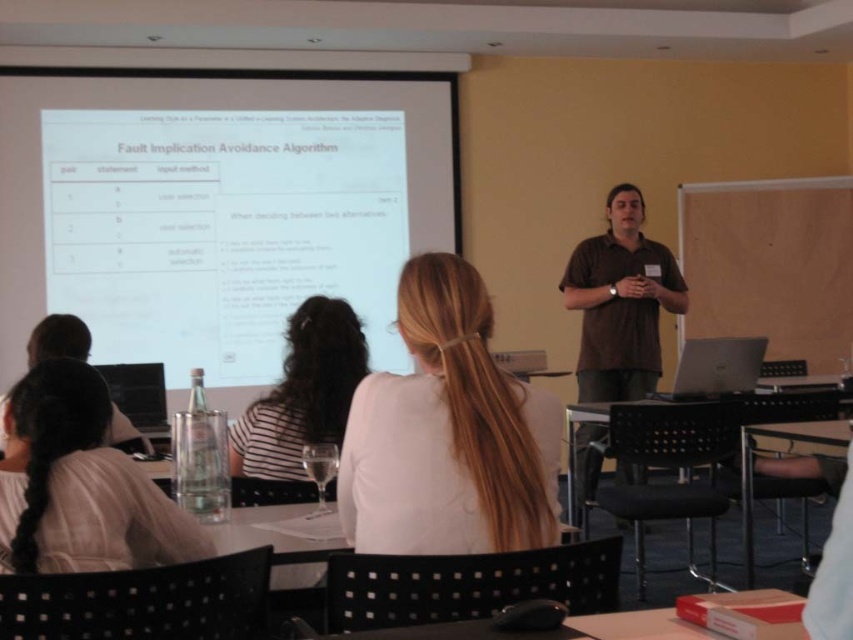
This screenshot has width=853, height=640. Describe the element at coordinates (216, 209) in the screenshot. I see `white glossy projector screen at upper center` at that location.

Between white glossy projector screen at upper center and clear glass water at lower left, which one has more height?

Standing taller between the two is white glossy projector screen at upper center.

Which is in front, point (399, 86) or point (123, 477)?

Point (123, 477) is in front.

Find the location of a particular element. white glossy projector screen at upper center is located at coordinates (216, 209).

How distant is matte black laptop at center from white glossy projector at upper center?

matte black laptop at center and white glossy projector at upper center are 2.15 meters apart from each other.

Which is more to the right, matte black laptop at center or white glossy projector at upper center?

Result: white glossy projector at upper center is more to the right.

At what (x,y) coordinates should I click in order to perform the action: click on matte black laptop at center. Please return your answer as a coordinate pair (x, y). This screenshot has height=640, width=853. Looking at the image, I should click on (57, 339).

Can you confirm if silver metallic laptop at lower right is thinner than matte black laptop at center?

Yes, silver metallic laptop at lower right is thinner than matte black laptop at center.

Can you confirm if silver metallic laptop at lower right is shorter than matte black laptop at center?

Correct, silver metallic laptop at lower right is not as tall as matte black laptop at center.

What do you see at coordinates (717, 365) in the screenshot? I see `silver metallic laptop at lower right` at bounding box center [717, 365].

This screenshot has width=853, height=640. Identify the location of silver metallic laptop at lower right. (717, 365).